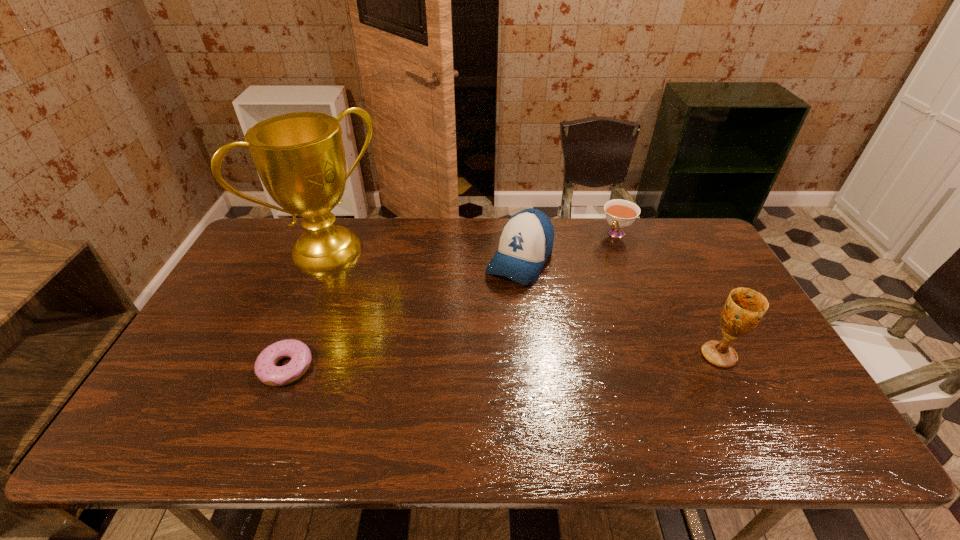
This screenshot has width=960, height=540. What are the coordinates of `free region located on the front-facing side of the third tallest object` in the screenshot? It's located at tap(462, 358).

Find the location of a particular element. vacant space located 0.120m on the front-facing side of the third tallest object is located at coordinates (491, 313).

The image size is (960, 540). Find the location of `free space located on the front-facing side of the third tallest object`. free space located on the front-facing side of the third tallest object is located at coordinates (491, 313).

At what (x,y) coordinates should I click in order to perform the action: click on vacant space positioned 0.300m on the shiny surface of the award. Please return your answer as a coordinate pair (x, y). The image size is (960, 540). Looking at the image, I should click on (415, 324).

You are a GUI agent. You are given a task and a screenshot of the screen. Output one action in this format:
    pyautogui.click(x=<x>, y=<y>)
    Task: Click on the vacant position located on the shiny surface of the award
    The height and width of the screenshot is (540, 960).
    Given the screenshot: What is the action you would take?
    pyautogui.click(x=431, y=338)

The image size is (960, 540). Find the location of `free space located 0.070m on the shiny surface of the award`. free space located 0.070m on the shiny surface of the award is located at coordinates (370, 284).

At what (x,y) coordinates should I click in order to perform the action: click on free space located on the side of the second shortest object with the handle. Please return your answer as a coordinate pair (x, y). The height and width of the screenshot is (540, 960). Looking at the image, I should click on (599, 260).

The image size is (960, 540). I want to click on vacant region located 0.120m on the side of the second shortest object with the handle, so click(x=598, y=262).

This screenshot has width=960, height=540. I want to click on free space located 0.090m on the side of the second shortest object with the handle, so click(x=601, y=257).

Identify the location of baseball cap that is at the far edge. (526, 241).